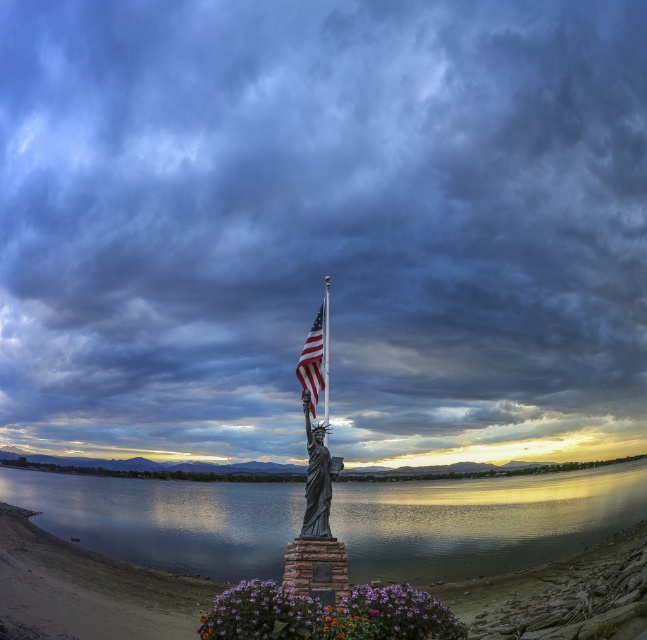
Question: Which of the following is the farthest from the observer?

Choices:
 (A) (322, 337)
 (B) (325, 301)
 (C) (364, 420)

Answer: (C)

Question: Does purple matte flowers at lower center have a smaller size compared to american flag at center?

Choices:
 (A) no
 (B) yes

Answer: (A)

Question: Estimate the real-world distances between objects in this image. Which object is closer to the purple matte flowers at lower center?

Choices:
 (A) polished metal flag pole at center
 (B) glossy water at statue center
 (C) american flag at center

Answer: (A)

Question: Which object is positioned farthest from the glossy water at statue center?

Choices:
 (A) metallic statue at center
 (B) polished metal flag pole at center
 (C) american flag at center
 (D) bronze statue of liberty at center

Answer: (A)

Question: Does metallic statue at center appear over american flag at center?

Choices:
 (A) yes
 (B) no

Answer: (A)

Question: Can you confirm if purple matte flowers at lower center is positioned below bronze statue of liberty at center?

Choices:
 (A) no
 (B) yes

Answer: (B)